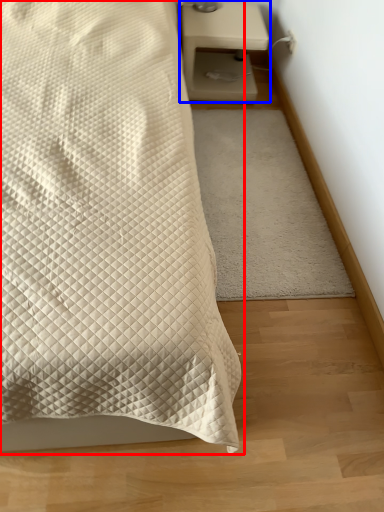
Question: Which object is closer to the camera taking this photo, bed (highlighted by a red box) or nightstand (highlighted by a blue box)?

Choices:
 (A) bed
 (B) nightstand

Answer: (A)